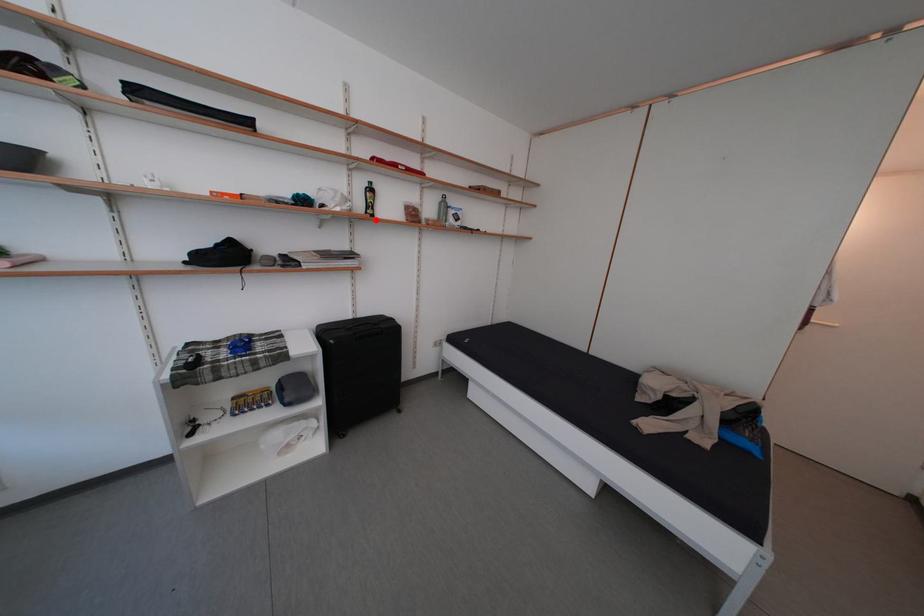
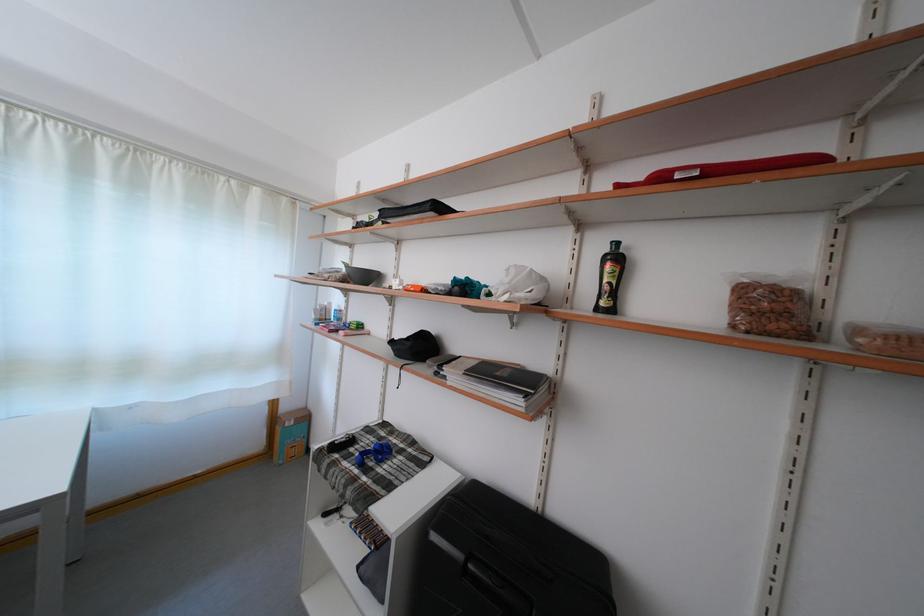
The point at the highlighted location is marked in the first image. Where is the corresponding point in the second image?

(606, 314)